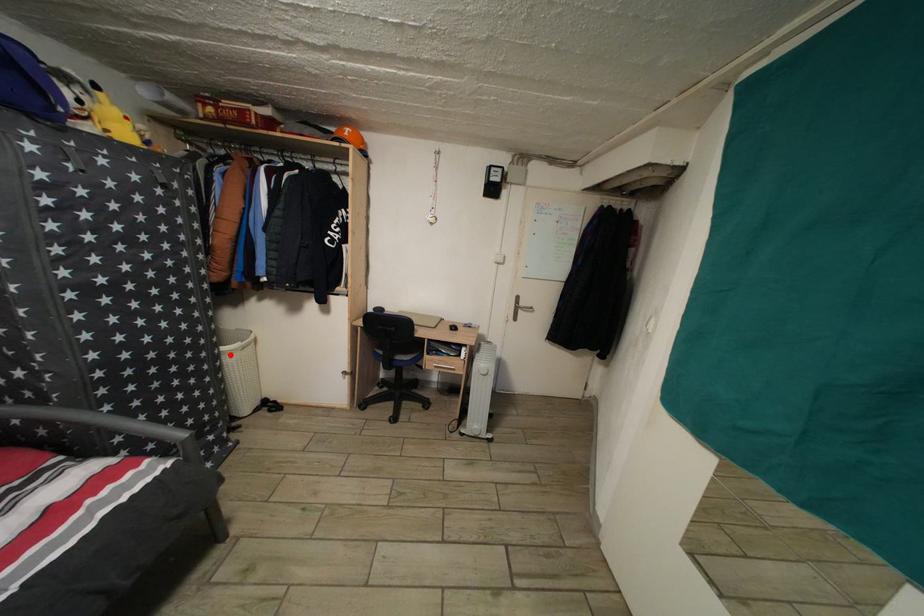
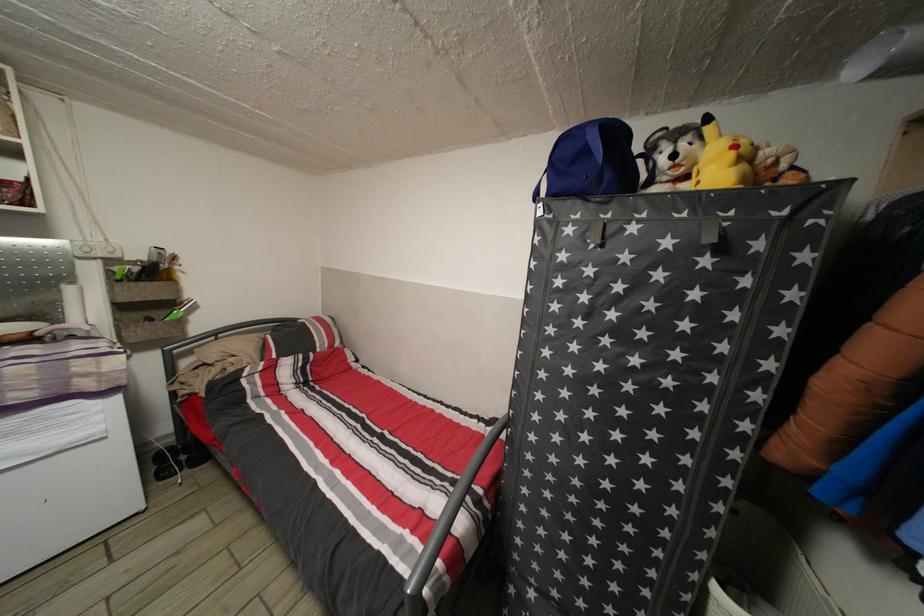
Locate, in the second image, the point that corresponds to the highlighted location in the first image.

(723, 594)